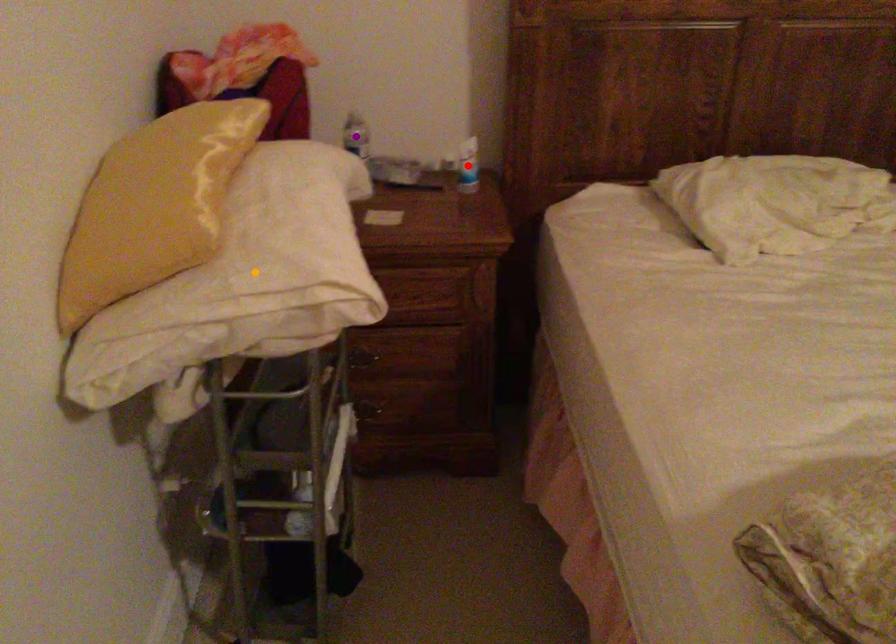
Order these from nearest to farthest:
1. red point
2. orange point
3. purple point

orange point
red point
purple point